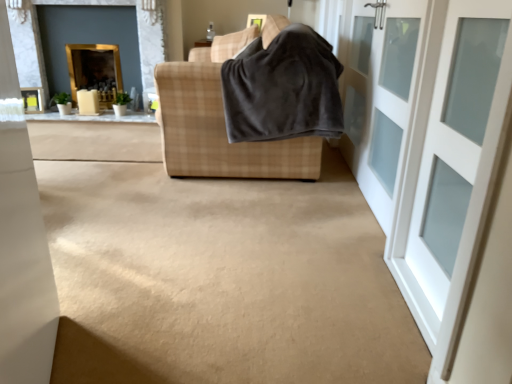
Question: Does gold-framed mirror at upper left, arranged as the 2th fireplace when viewed from the left, have a greater height compared to white glass door at right, which appears as the second door when viewed from the front?

Choices:
 (A) yes
 (B) no

Answer: (B)

Question: Does gold-framed mirror at upper left, arranged as the 2th fireplace when viewed from the left, touch white glass door at right, marked as the 1th door in a back-to-front arrangement?

Choices:
 (A) yes
 (B) no

Answer: (B)

Question: From a real-world perspective, is gold-framed mirror at upper left, which is the first fireplace in right-to-left order, located beneath white glass door at right, which appears as the second door when viewed from the front?

Choices:
 (A) no
 (B) yes

Answer: (A)

Question: Can you confirm if gold-framed mirror at upper left, which is the first fireplace in right-to-left order, is positioned to the right of white glass door at right, marked as the 1th door in a back-to-front arrangement?

Choices:
 (A) no
 (B) yes

Answer: (A)

Question: Considering the relative sizes of gold-framed mirror at upper left, arranged as the 2th fireplace when viewed from the left, and white glass door at right, marked as the 1th door in a back-to-front arrangement, in the image provided, is gold-framed mirror at upper left, arranged as the 2th fireplace when viewed from the left, wider than white glass door at right, marked as the 1th door in a back-to-front arrangement,?

Choices:
 (A) yes
 (B) no

Answer: (A)

Question: From the image's perspective, does gold-framed mirror at upper left, which is the first fireplace in right-to-left order, appear lower than white glass door at right, marked as the 1th door in a back-to-front arrangement?

Choices:
 (A) no
 (B) yes

Answer: (A)

Question: Considering the relative positions of dark gray fleece blanket at center and white glass door at right, marked as the 1th door in a back-to-front arrangement, in the image provided, is dark gray fleece blanket at center to the left of white glass door at right, marked as the 1th door in a back-to-front arrangement, from the viewer's perspective?

Choices:
 (A) no
 (B) yes

Answer: (B)

Question: From the image's perspective, is dark gray fleece blanket at center on top of white glass door at right, marked as the 1th door in a back-to-front arrangement?

Choices:
 (A) no
 (B) yes

Answer: (B)

Question: Are dark gray fleece blanket at center and white glass door at right, marked as the 1th door in a back-to-front arrangement, located far from each other?

Choices:
 (A) yes
 (B) no

Answer: (B)

Question: Considering the relative positions of dark gray fleece blanket at center and white glass door at right, marked as the 1th door in a back-to-front arrangement, in the image provided, is dark gray fleece blanket at center to the right of white glass door at right, marked as the 1th door in a back-to-front arrangement, from the viewer's perspective?

Choices:
 (A) yes
 (B) no

Answer: (B)

Question: Does dark gray fleece blanket at center have a smaller size compared to white glass door at right, marked as the 1th door in a back-to-front arrangement?

Choices:
 (A) yes
 (B) no

Answer: (B)

Question: From a real-world perspective, is dark gray fleece blanket at center located beneath white glass door at right, which appears as the second door when viewed from the front?

Choices:
 (A) yes
 (B) no

Answer: (B)

Question: Is plaid fabric sofa at center not close to dark gray fleece blanket at center?

Choices:
 (A) no
 (B) yes

Answer: (A)